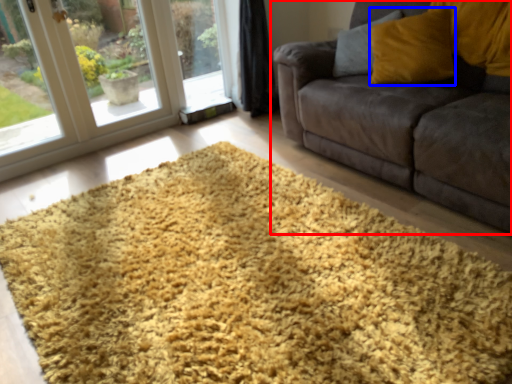
Question: Among these objects, which one is nearest to the camera, studio couch (highlighted by a red box) or throw pillow (highlighted by a blue box)?

Choices:
 (A) studio couch
 (B) throw pillow

Answer: (A)